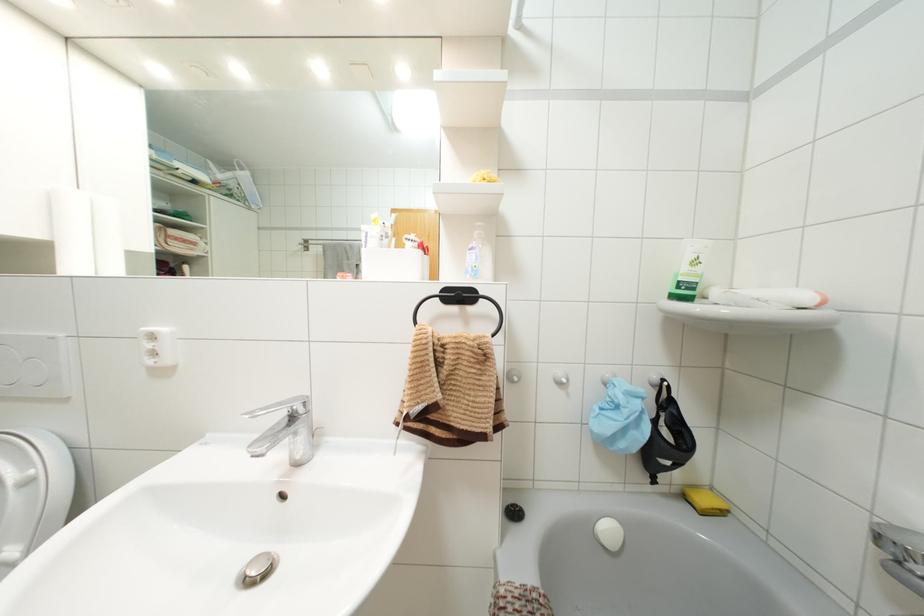
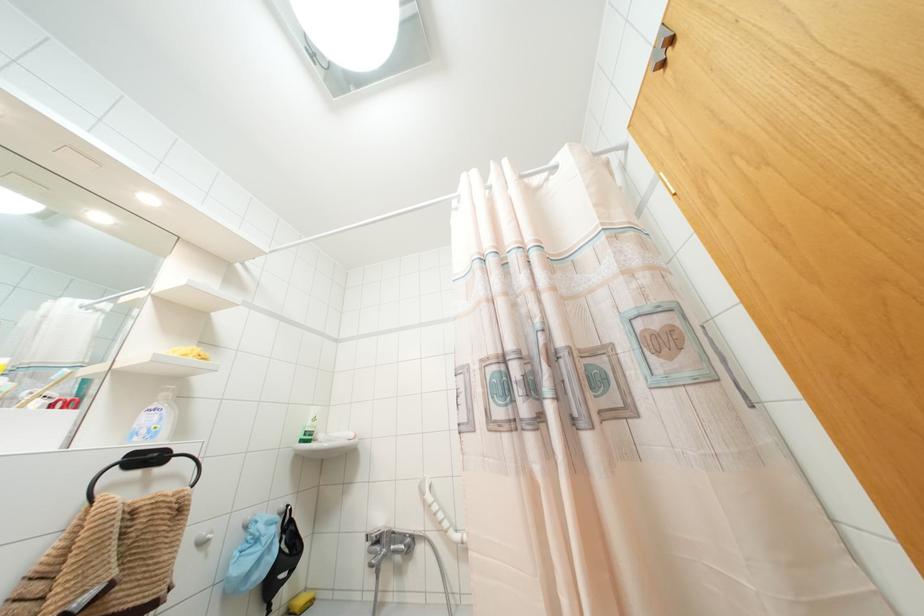
The point at (701,500) is marked in the first image. Where is the corresponding point in the second image?

(299, 601)